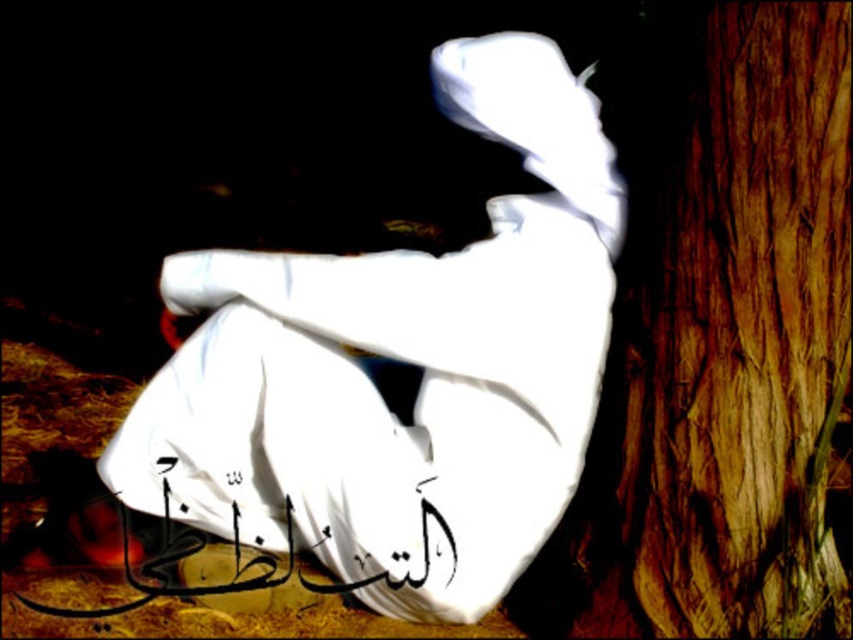
Question: Is white cloth at center positioned in front of smooth brown bark at right?

Choices:
 (A) no
 (B) yes

Answer: (A)

Question: Which point is farther from the camera taking this photo?

Choices:
 (A) (728, 618)
 (B) (264, 576)
 (C) (514, 269)

Answer: (B)

Question: Is white cloth at center behind black calligraphy at lower center?

Choices:
 (A) yes
 (B) no

Answer: (B)

Question: Which of the following is the closest to the observer?

Choices:
 (A) (177, 266)
 (B) (624, 100)
 (C) (164, 595)

Answer: (C)

Question: Which object appears farthest from the camera in this image?

Choices:
 (A) black calligraphy at lower center
 (B) white cloth at center

Answer: (A)

Question: Does white cloth at center have a smaller size compared to black calligraphy at lower center?

Choices:
 (A) no
 (B) yes

Answer: (A)